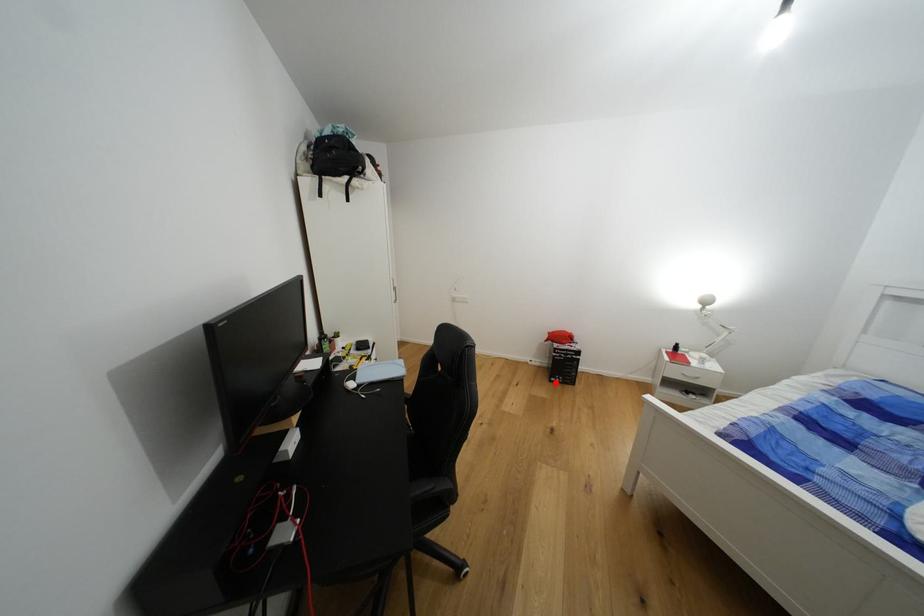
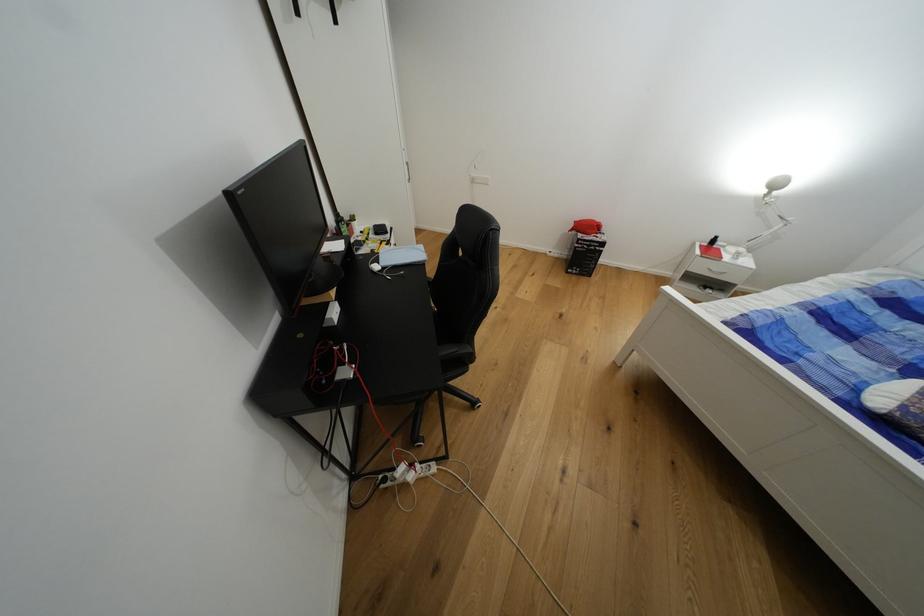
In the second image, find the point that corresponds to the highlighted location in the first image.

(573, 274)